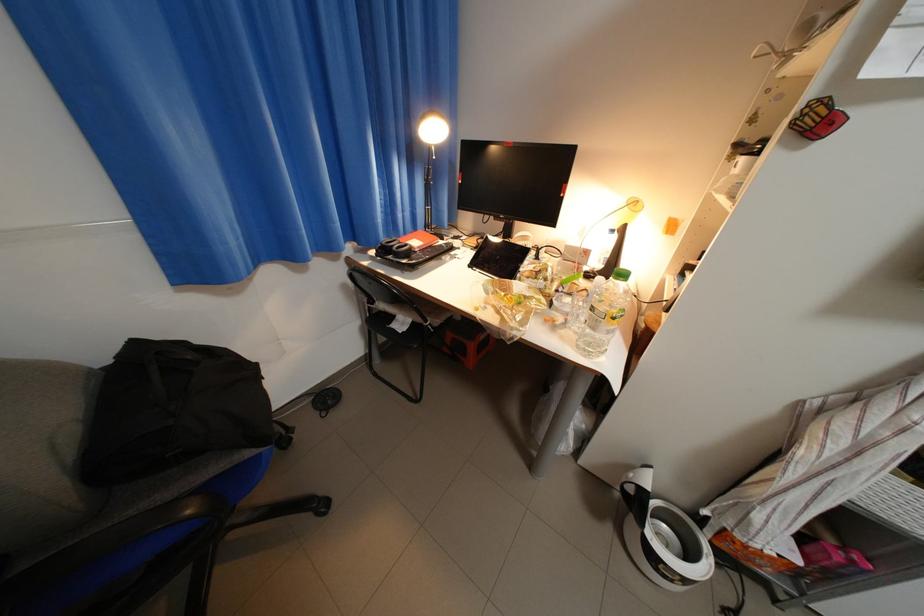
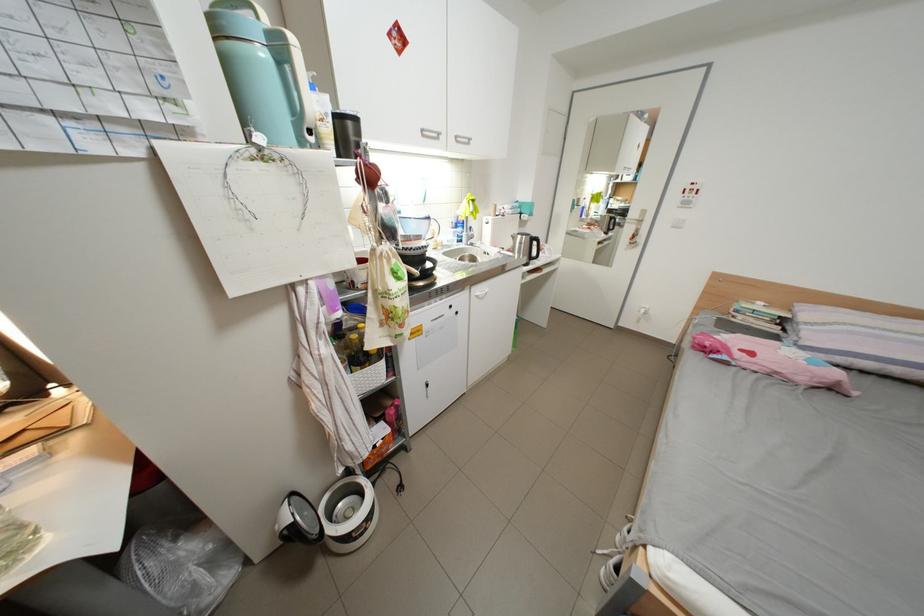
Based on the photo, based on the continuous images, in which direction is the camera rotating?

The camera's rotation is toward right-down.